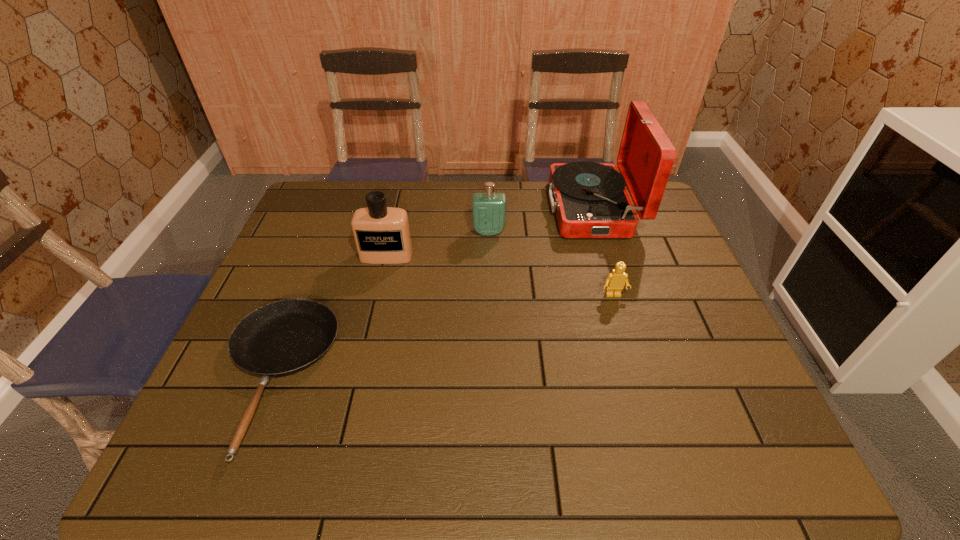
I want to click on object at the near left corner, so click(x=284, y=337).

You are a GUI agent. You are given a task and a screenshot of the screen. Output one action in this format:
    pyautogui.click(x=<x>, y=<y>)
    Task: Click on the object that is at the far right corner
    
    Given the screenshot: What is the action you would take?
    pyautogui.click(x=590, y=199)

Where is `vacant area at the far edge`? vacant area at the far edge is located at coordinates (417, 210).

Image resolution: width=960 pixels, height=540 pixels. Identify the location of free spot at the near edge of the desktop. (317, 474).

Locate an element on the screen. The height and width of the screenshot is (540, 960). vacant space at the left edge of the desktop is located at coordinates [300, 279].

In the image, there is a desktop. Find the location of `free space at the right edge`. free space at the right edge is located at coordinates (644, 268).

The height and width of the screenshot is (540, 960). Find the location of `vacant space at the far left corner`. vacant space at the far left corner is located at coordinates [x=333, y=190].

This screenshot has height=540, width=960. Find the location of `vacant space that is in between the shorter perfume and the shortest object`. vacant space that is in between the shorter perfume and the shortest object is located at coordinates point(382,304).

You are a GUI agent. You are given a task and a screenshot of the screen. Output one action in this format:
    pyautogui.click(x=<x>, y=<y>)
    Task: Click on the free spot between the tallest object and the second shortest object
    
    Given the screenshot: What is the action you would take?
    pyautogui.click(x=603, y=252)

Find the location of a particular element. The height and width of the screenshot is (540, 960). free space between the nearest object and the fourth farthest object is located at coordinates (444, 336).